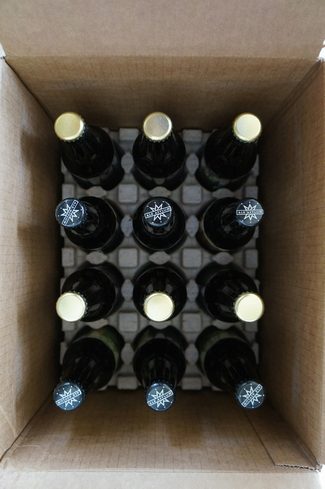
Find the location of a particular element. The image size is (325, 489). bottle holder is located at coordinates (187, 189), (122, 327).